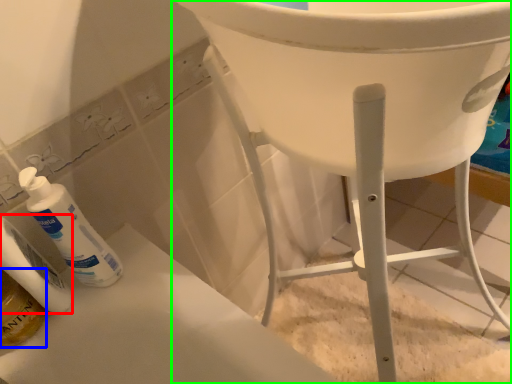
Question: Which object is positioned farthest from toiletry (highlighted by a red box)? Select from mouthwash (highlighted by a blue box) and furniture (highlighted by a green box).

Choices:
 (A) mouthwash
 (B) furniture

Answer: (B)